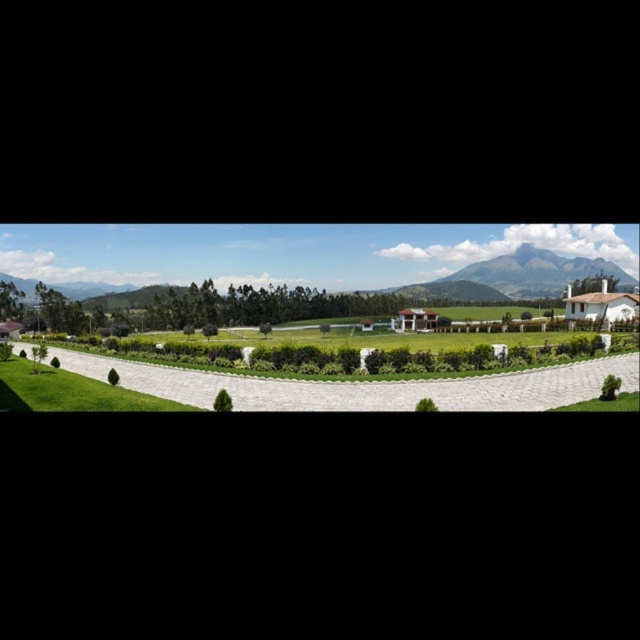
You are standing at the center of the curved stone pathway in the rural landscape. You notice two points marked in the scene. The first point is at coordinates point (476,272), and the second is at point (138,340). Which point is closer to your current position?

Point (476,272) is further to the viewer than point (138,340), so the closer point to your current position on the curved stone pathway would be point (138,340).

You are standing at the edge of the green grass at center and want to walk towards the rugged brown mountain at center. Which direction should you head?

You should head to the right because the green grass at center is to the left of rugged brown mountain at center, so moving right from the grass will lead you towards the mountain.